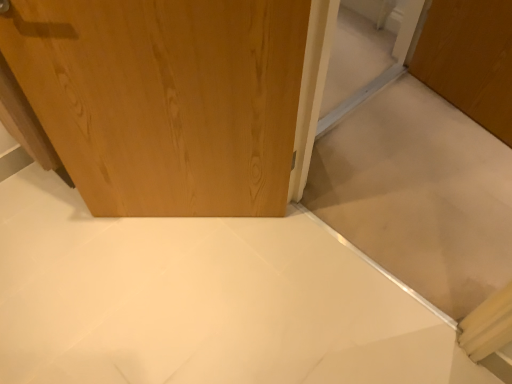
At what (x,y) coordinates should I click in order to perform the action: click on vacant space to the right of wooden door at upper left. Please return your answer as a coordinate pair (x, y). The height and width of the screenshot is (384, 512). Looking at the image, I should click on (290, 272).